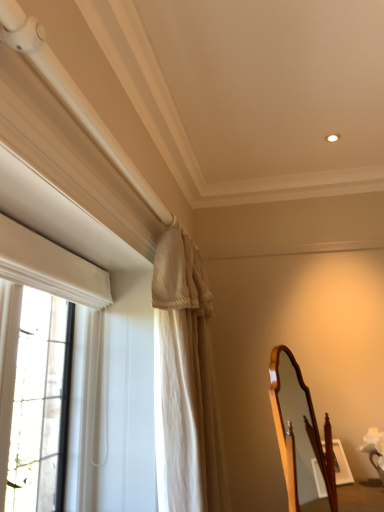
Find the location of `beige fabric curtain at upper center`. beige fabric curtain at upper center is located at coordinates (185, 382).

The image size is (384, 512). Describe the element at coordinates (185, 382) in the screenshot. I see `beige fabric curtain at upper center` at that location.

Where is `beige fabric curtain at upper center`? The width and height of the screenshot is (384, 512). beige fabric curtain at upper center is located at coordinates (185, 382).